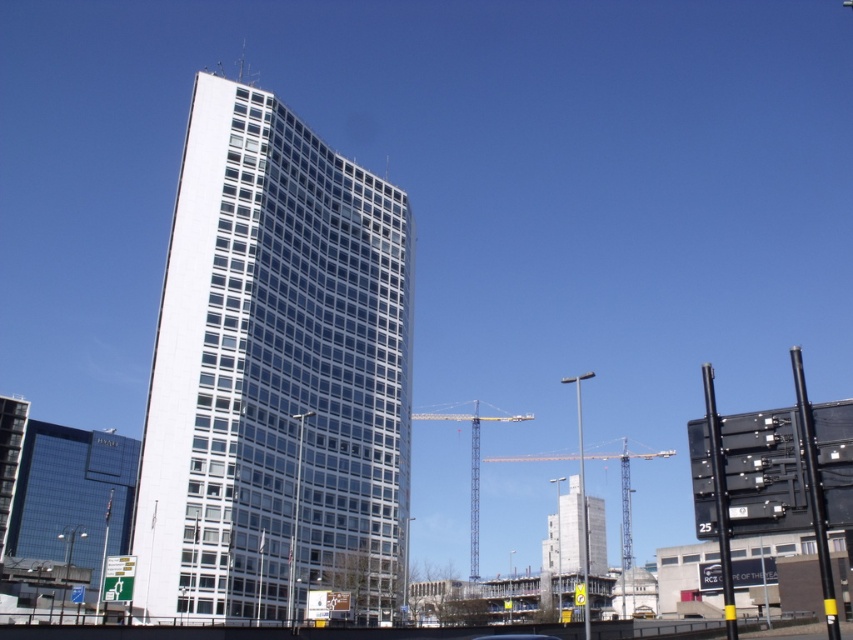
Question: Does white concrete building at center have a greater width compared to metallic yellow crane at center?

Choices:
 (A) no
 (B) yes

Answer: (A)

Question: Which of these objects is positioned closest to the yellow metallic crane at center?

Choices:
 (A) metallic yellow crane at center
 (B) white glass building at center
 (C) white concrete building at center

Answer: (C)

Question: Is yellow metallic crane at center wider than metallic yellow crane at center?

Choices:
 (A) yes
 (B) no

Answer: (B)

Question: Which of the following is the farthest from the observer?

Choices:
 (A) (216, 156)
 (B) (492, 416)

Answer: (B)

Question: Does white glass building at center have a larger size compared to white concrete building at center?

Choices:
 (A) no
 (B) yes

Answer: (A)

Question: Considering the real-world distances, which object is closest to the yellow metallic crane at center?

Choices:
 (A) white concrete building at center
 (B) metallic yellow crane at center

Answer: (A)